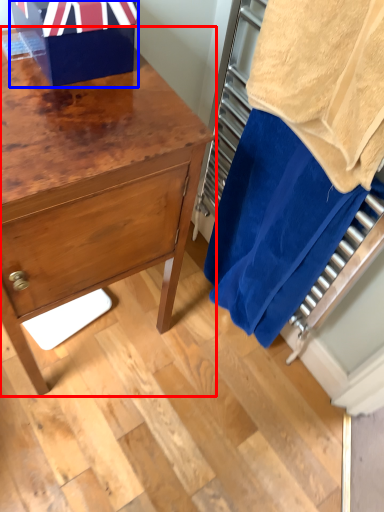
Question: Which object appears farthest to the camera in this image, chest of drawers (highlighted by a red box) or gift box (highlighted by a blue box)?

Choices:
 (A) chest of drawers
 (B) gift box

Answer: (B)